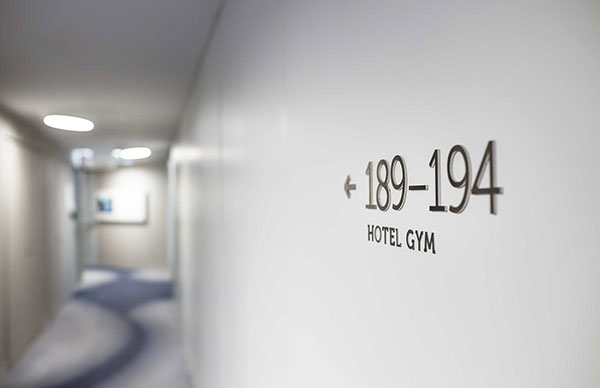
Identify the location of hotel gym. (391, 239).